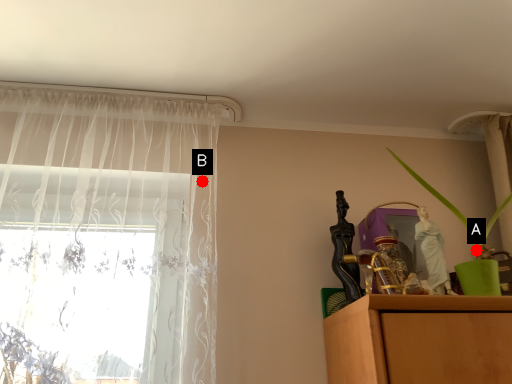
Question: Two points are circled on the image, labeled by A and B beside each circle. Which point is farther to the camera?

Choices:
 (A) A is further
 (B) B is further

Answer: (B)